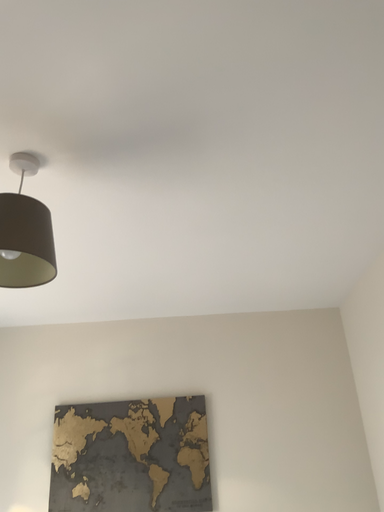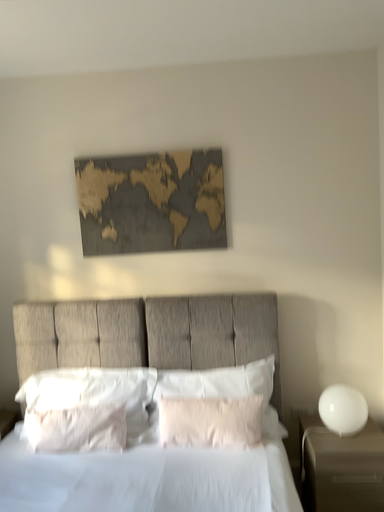
Question: Which way did the camera rotate in the video?

Choices:
 (A) rotated upward
 (B) rotated downward

Answer: (B)